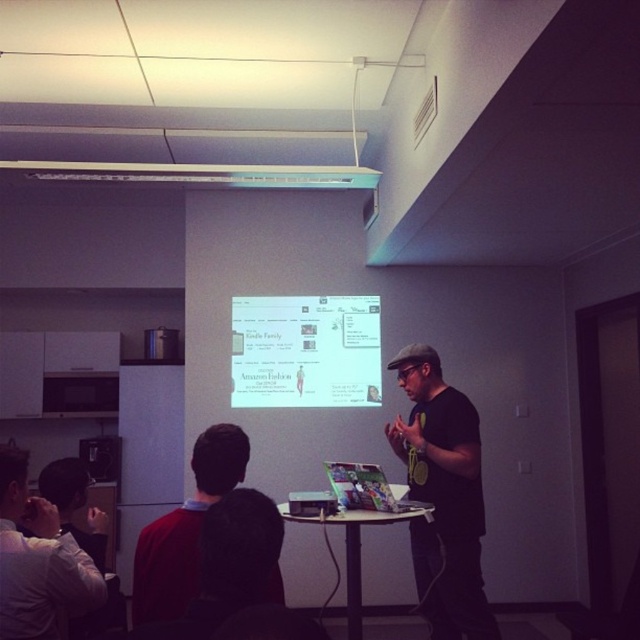
Question: Based on their relative distances, which object is nearer to the dark brown hair at center?

Choices:
 (A) matte black projector at center
 (B) matte black shirt at lower left

Answer: (B)

Question: Which object appears farthest from the camera in this image?

Choices:
 (A) white glossy projection screen at center
 (B) matte black shirt at lower left
 (C) dark brown hair at center

Answer: (A)

Question: Which point appears farthest from the camera in this image?

Choices:
 (A) (29, 520)
 (B) (289, 316)
 (C) (474, 490)

Answer: (B)

Question: Is black matte shirt at center wider than matte black projector at center?

Choices:
 (A) no
 (B) yes

Answer: (B)

Question: Can you confirm if black matte shirt at center is thinner than white glossy projection screen at center?

Choices:
 (A) yes
 (B) no

Answer: (A)

Question: Can you confirm if white glossy projection screen at center is thinner than dark brown hair at center?

Choices:
 (A) no
 (B) yes

Answer: (A)